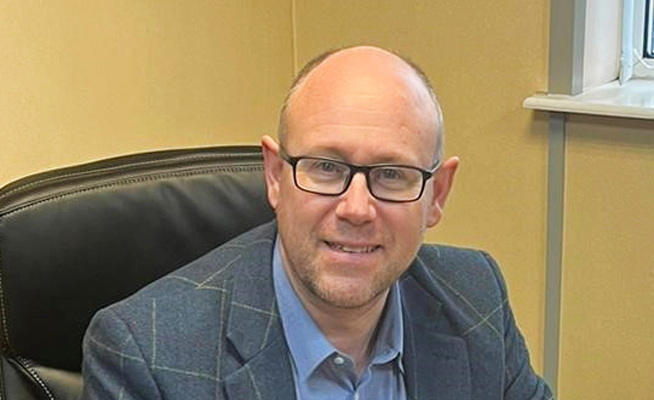
Find the location of a particular element. The image size is (654, 400). corner of back wall and side wall is located at coordinates tap(294, 64), tap(297, 44), tap(290, 11).